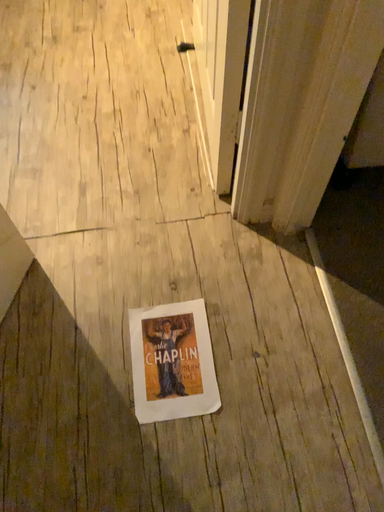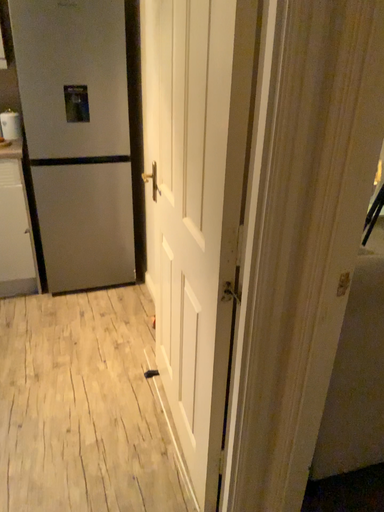
Question: Which way did the camera rotate in the video?

Choices:
 (A) rotated downward
 (B) rotated upward

Answer: (B)